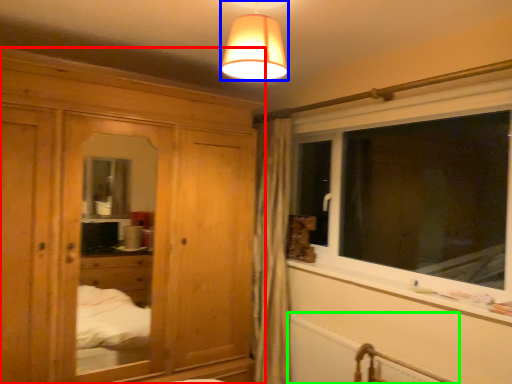
Question: Which object is positioned farthest from cabinetry (highlighted by a red box)? Select from lamp (highlighted by a blue box) and radiator (highlighted by a green box).

Choices:
 (A) lamp
 (B) radiator

Answer: (A)